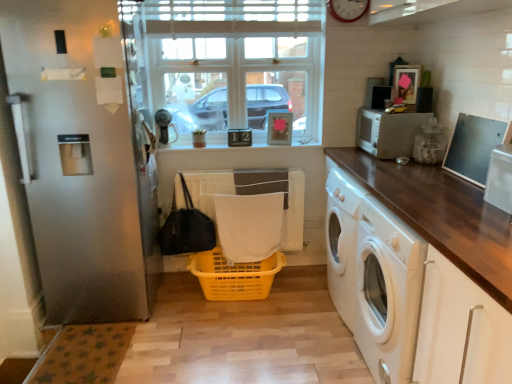
Question: Does white matte microwave at upper right have a greater height compared to yellow plastic basket at center?

Choices:
 (A) yes
 (B) no

Answer: (A)

Question: From the image's perspective, is white matte microwave at upper right on yellow plastic basket at center?

Choices:
 (A) no
 (B) yes

Answer: (B)

Question: Is white matte microwave at upper right bigger than yellow plastic basket at center?

Choices:
 (A) yes
 (B) no

Answer: (B)

Question: Is white matte microwave at upper right far away from yellow plastic basket at center?

Choices:
 (A) yes
 (B) no

Answer: (A)

Question: From a real-world perspective, is white matte microwave at upper right located higher than yellow plastic basket at center?

Choices:
 (A) no
 (B) yes

Answer: (B)

Question: From the image's perspective, is white glass window at center located above or below dark wood countertop at right?

Choices:
 (A) above
 (B) below

Answer: (A)

Question: From a real-world perspective, is white glass window at center positioned above or below dark wood countertop at right?

Choices:
 (A) below
 (B) above

Answer: (B)

Question: Is white glass window at center spatially inside dark wood countertop at right, or outside of it?

Choices:
 (A) outside
 (B) inside

Answer: (A)

Question: Is point 145,16 positioned closer to the camera than point 396,203?

Choices:
 (A) closer
 (B) farther

Answer: (B)

Question: Relative to yellow plastic basket at center, is satin silver screen door at left in front or behind?

Choices:
 (A) front
 (B) behind

Answer: (A)

Question: Is satin silver screen door at left inside or outside of yellow plastic basket at center?

Choices:
 (A) outside
 (B) inside

Answer: (A)

Question: Considering the positions of satin silver screen door at left and yellow plastic basket at center in the image, is satin silver screen door at left wider or thinner than yellow plastic basket at center?

Choices:
 (A) wide
 (B) thin

Answer: (A)

Question: Is satin silver screen door at left to the left or to the right of yellow plastic basket at center in the image?

Choices:
 (A) left
 (B) right

Answer: (A)

Question: From a real-world perspective, is metallic silver microwave at right physically located above or below dark wood countertop at right?

Choices:
 (A) above
 (B) below

Answer: (A)

Question: Is metallic silver microwave at right in front of or behind dark wood countertop at right in the image?

Choices:
 (A) front
 (B) behind

Answer: (B)